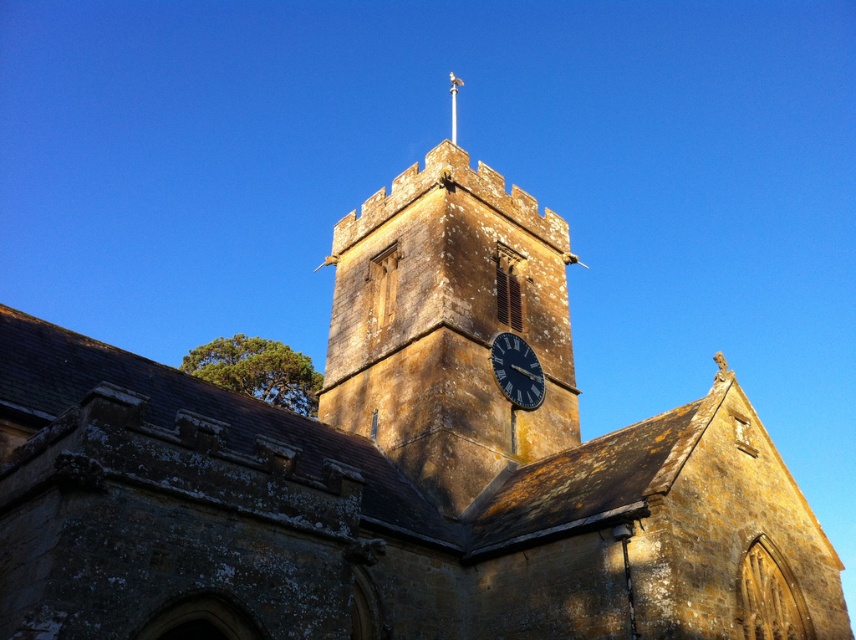
You are standing in the middle of the square in front of the historic stone church. You want to locate the yellow stone clock tower at center. Where should you look?

You should look at point (449, 324) to find the yellow stone clock tower at center.

You are standing in front of the historic stone church and notice two prominent features. The dark blue glass clock at center and the silver metallic spire at upper center. Based on their positions, which one is located to the left when viewed from your perspective?

The dark blue glass clock at center is to the left of the silver metallic spire at upper center, so when viewed from your perspective, the dark blue glass clock at center is located to the left.

You are standing in front of the historic stone church and want to take a photo. You notice two points marked in the image. Which point, point [518,404] or point [455,97], will appear larger in your photo?

Point [518,404] appears closer to the camera than point [455,97], so it will appear larger in the photo.